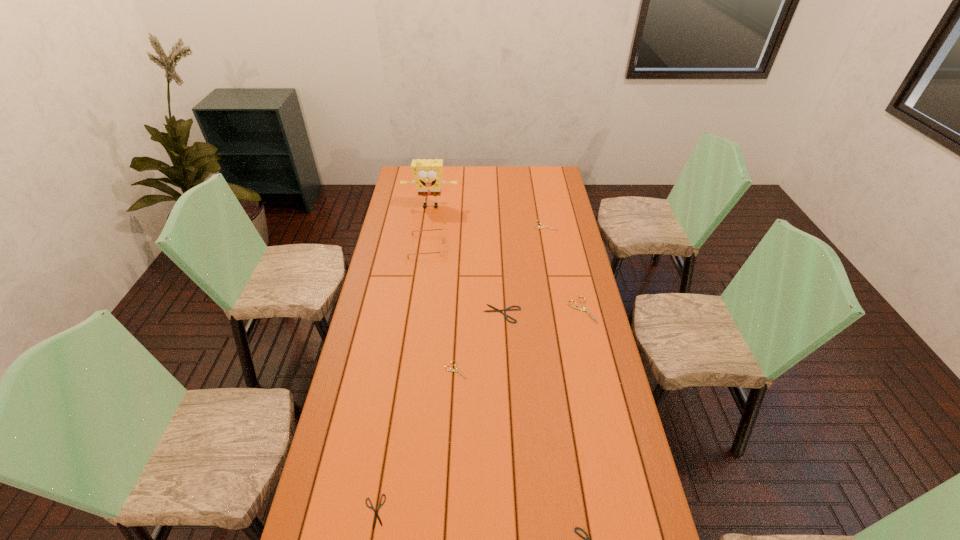
Where is `free space located 0.390m on the back of the leftmost shears`? This screenshot has width=960, height=540. free space located 0.390m on the back of the leftmost shears is located at coordinates pyautogui.click(x=396, y=376).

At what (x,y) coordinates should I click in order to perform the action: click on sponge located in the left edge section of the desktop. Please return your answer as a coordinate pair (x, y). The height and width of the screenshot is (540, 960). Looking at the image, I should click on (427, 174).

At what (x,y) coordinates should I click in order to perform the action: click on spectacles that is positioned at the left edge. Please return your answer as a coordinate pair (x, y). The image size is (960, 540). Looking at the image, I should click on (441, 251).

At what (x,y) coordinates should I click in order to perform the action: click on shears present at the left edge. Please return your answer as a coordinate pair (x, y). The width and height of the screenshot is (960, 540). Looking at the image, I should click on (376, 516).

Find the location of `vacant space at the far edge of the desktop`. vacant space at the far edge of the desktop is located at coordinates (470, 184).

In order to click on free space at the left edge of the desktop in this screenshot , I will do `click(409, 192)`.

The height and width of the screenshot is (540, 960). In the image, there is a desktop. Identify the location of vacant space at the right edge. (598, 400).

You are a GUI agent. You are given a task and a screenshot of the screen. Output one action in this format:
    pyautogui.click(x=<x>, y=<y>)
    Task: Click on the blank space at the far left corner of the desktop
    
    Given the screenshot: What is the action you would take?
    pyautogui.click(x=410, y=180)

In the image, there is a desktop. Where is `vacant space at the far right corner`? vacant space at the far right corner is located at coordinates (544, 168).

The height and width of the screenshot is (540, 960). In order to click on free spot between the beige spectacles and the third nearest object in this screenshot , I will do `click(442, 308)`.